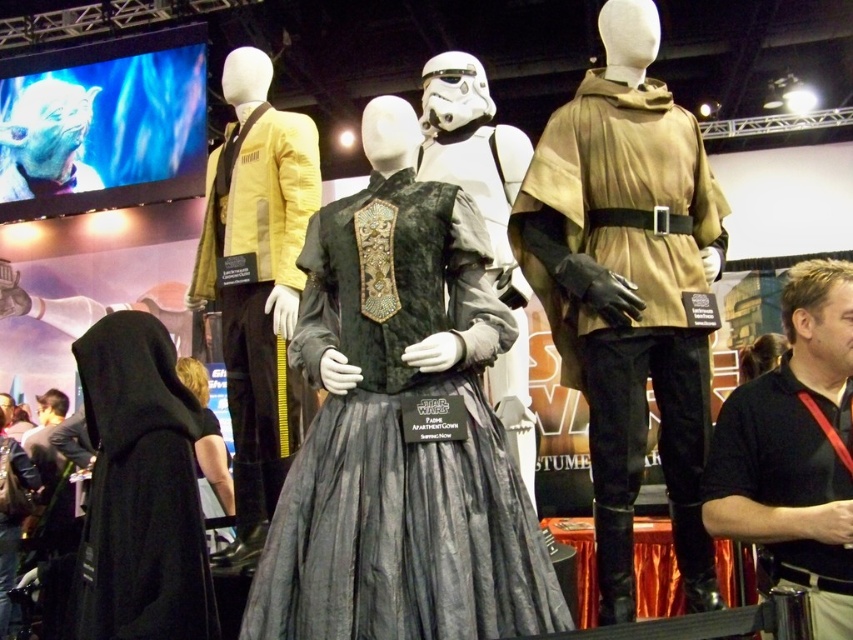
You are a photographer at the Star Wars exhibit and want to take a photo of both the black cotton polo shirt at center right and the black velvet dress at lower left. However, you notice that one is blocking the other. Which one should you move to ensure both are fully visible in the photo?

The black cotton polo shirt at center right is in front of the black velvet dress at lower left. To ensure both are fully visible, you should move the black cotton polo shirt at center right out of the way so that the black velvet dress at lower left is no longer blocked.

You are at a Star Wars costume exhibition and want to know which of the two items is bigger. You see the black cotton polo shirt at center right and the black velvet dress at lower left. Which one is larger?

The black velvet dress at lower left is larger than the black cotton polo shirt at center right.